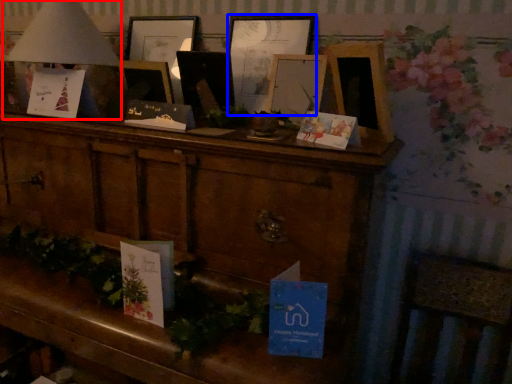
Question: Which object appears closest to the camera in this image, table lamp (highlighted by a red box) or picture frame (highlighted by a blue box)?

Choices:
 (A) table lamp
 (B) picture frame

Answer: (A)